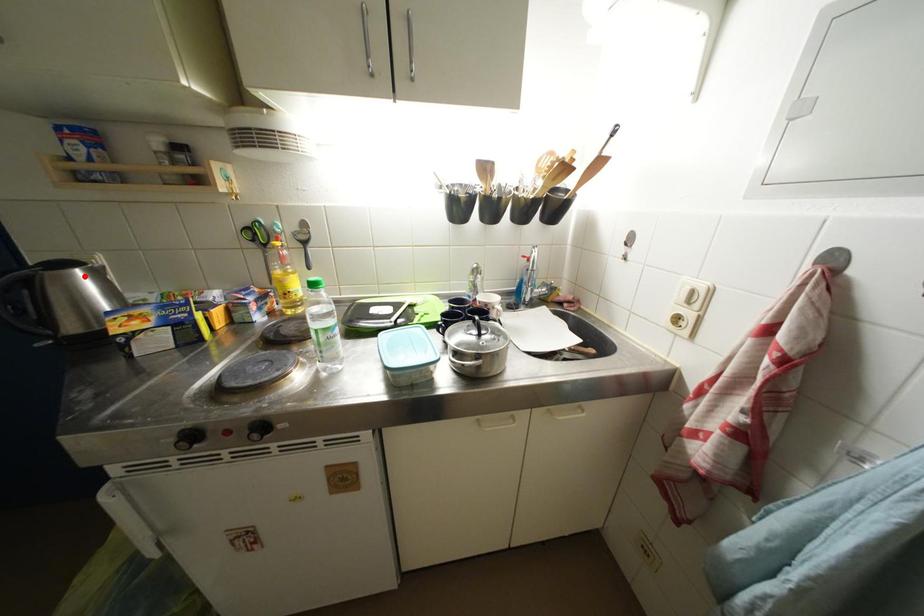
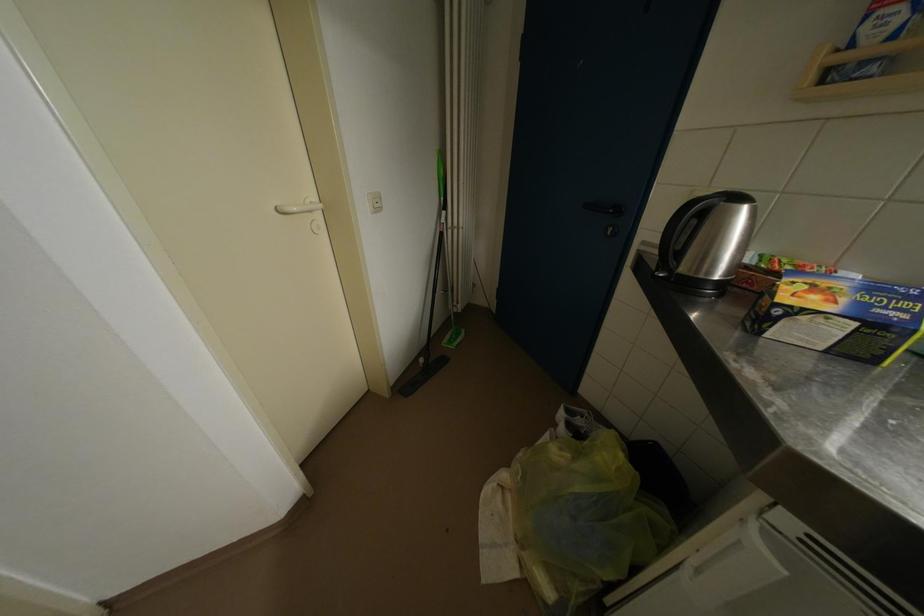
Where in the second image is the point corresponding to the highlighted location from the first image?

(752, 213)